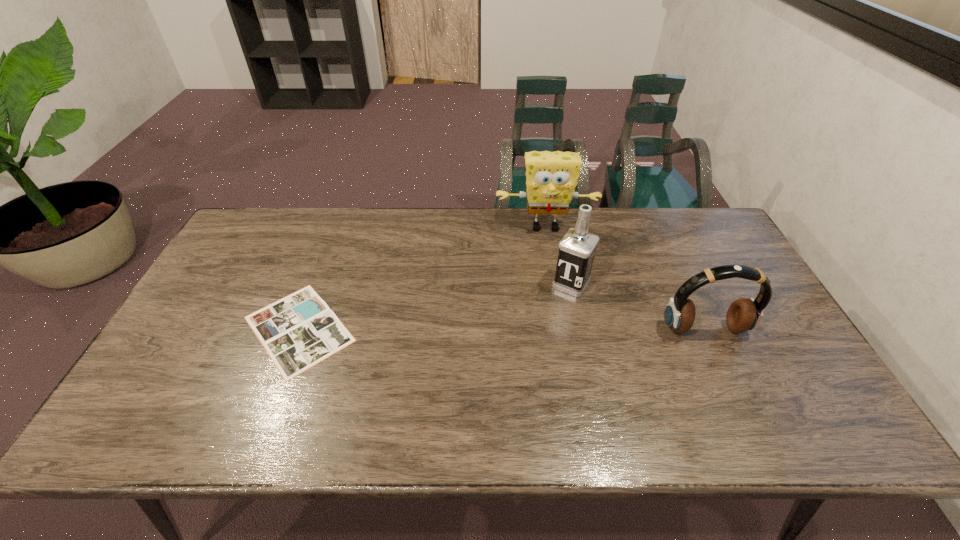
Locate an element on the screen. vacant space at the right edge of the desktop is located at coordinates (739, 345).

In the image, there is a desktop. At what (x,y) coordinates should I click in order to perform the action: click on vacant space at the near left corner. Please return your answer as a coordinate pair (x, y). This screenshot has width=960, height=540. Looking at the image, I should click on (150, 403).

You are a GUI agent. You are given a task and a screenshot of the screen. Output one action in this format:
    pyautogui.click(x=<x>, y=<y>)
    Task: Click on the vacant space at the near right corner
    
    Given the screenshot: What is the action you would take?
    pyautogui.click(x=772, y=401)

Identify the location of vacant space that's between the book and the vodka. The width and height of the screenshot is (960, 540). (435, 306).

Locate an element on the screen. Image resolution: width=960 pixels, height=540 pixels. empty location between the book and the sponge is located at coordinates (422, 278).

Locate an element on the screen. The height and width of the screenshot is (540, 960). vacant area between the vodka and the shortest object is located at coordinates (435, 306).

Identify the location of vacant region between the book and the third tallest object. (502, 329).

Image resolution: width=960 pixels, height=540 pixels. I want to click on empty space between the sponge and the rightmost object, so coord(625,278).

Locate an element on the screen. Image resolution: width=960 pixels, height=540 pixels. empty space that is in between the vodka and the leftmost object is located at coordinates (435, 306).

Where is `vacant area between the book and the vodka`? This screenshot has width=960, height=540. vacant area between the book and the vodka is located at coordinates (435, 306).